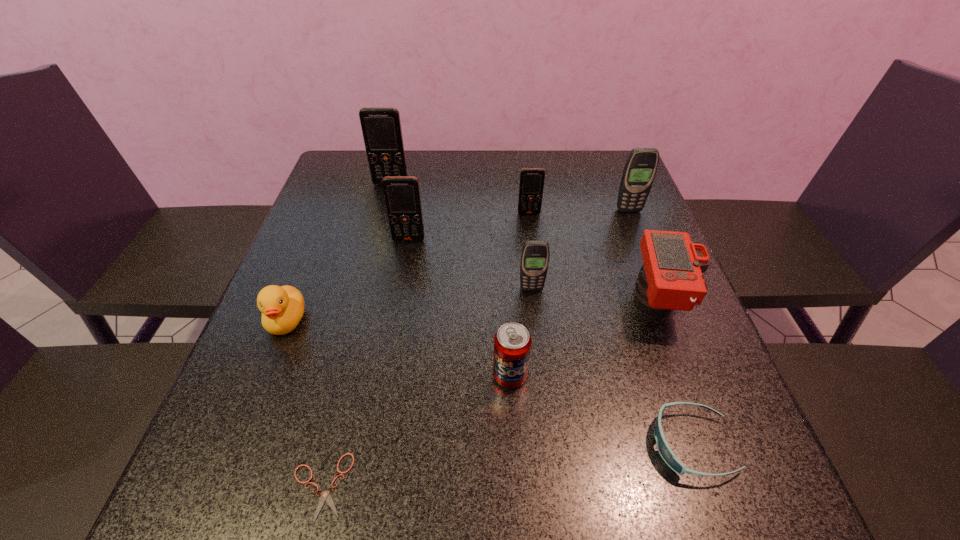
You are a GUI agent. You are given a task and a screenshot of the screen. Output one action in this format:
    pyautogui.click(x=<x>, y=<y>)
    Task: Click on the farthest object
    
    Given the screenshot: What is the action you would take?
    pyautogui.click(x=381, y=126)

Identify the location of the tallest cellular telephone. Image resolution: width=960 pixels, height=540 pixels. (381, 126).

You are a GUI agent. You are given a task and a screenshot of the screen. Output one action in this format:
    pyautogui.click(x=<x>, y=<y>)
    Task: Click on the farther gray cellular telephone
    
    Given the screenshot: What is the action you would take?
    pyautogui.click(x=640, y=168)

Find the location of a particular element. Image resolution: width=960 pixels, height=540 pixels. the bigger gray cellular telephone is located at coordinates (640, 168).

Identify the location of the seventh nearest object. (402, 198).

This screenshot has height=540, width=960. I want to click on the nearest orange cellular telephone, so click(x=402, y=198).

What are the coordinates of `the second farthest orange cellular telephone` in the screenshot? It's located at (531, 185).

The height and width of the screenshot is (540, 960). I want to click on the rightmost orange cellular telephone, so click(531, 185).

This screenshot has width=960, height=540. In order to click on the left gray cellular telephone in this screenshot , I will do `click(535, 254)`.

The height and width of the screenshot is (540, 960). What are the coordinates of `the nearer gray cellular telephone` in the screenshot? It's located at click(535, 254).